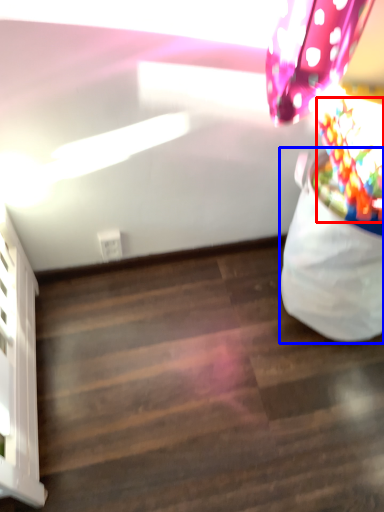
Question: Which object is closer to the camera taking this photo, flower (highlighted by a red box) or bean bag chair (highlighted by a blue box)?

Choices:
 (A) flower
 (B) bean bag chair

Answer: (A)